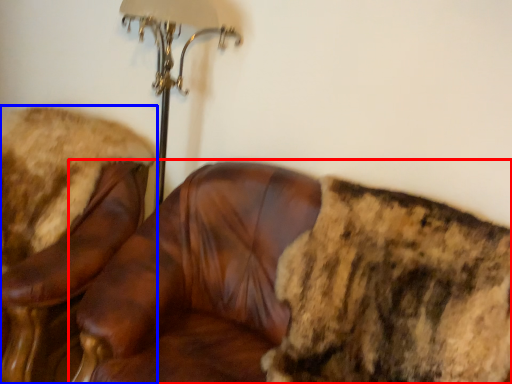
Question: Which object appears farthest to the camera in this image, chair (highlighted by a red box) or chair (highlighted by a blue box)?

Choices:
 (A) chair
 (B) chair

Answer: (B)